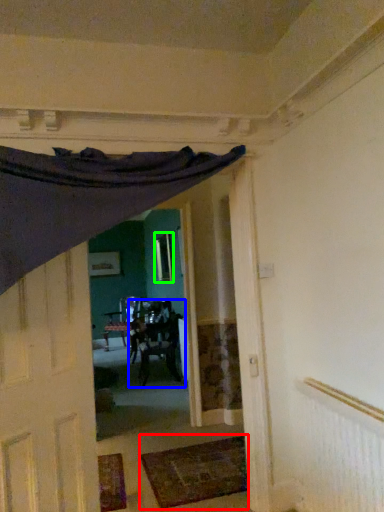
Question: Based on their relative distances, which object is farther from mat (highlighted by a red box)? Choose from chair (highlighted by a blue box) and window (highlighted by a green box).

Choices:
 (A) chair
 (B) window

Answer: (B)